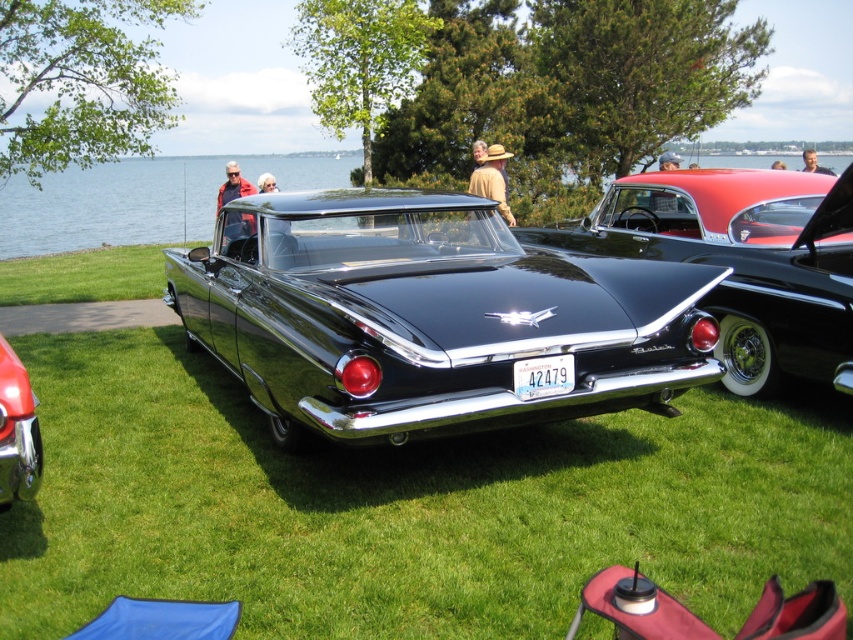
You are a photographer planning to capture both the glossy black car at center and the shiny red car at lower left in a single frame. Given that your camera can only accommodate objects within a 10m width, can you fit both cars side by side without cropping?

The glossy black car at center is wider than the shiny red car at lower left. Since the camera can only accommodate 10 meters, but the combined width of both cars may exceed this limit, it depends on their exact dimensions. However, the description only states the glossy black car is wider, not the total width. Without specific measurements, it is uncertain if they can fit together.

You are a photographer at the car exhibition and need to capture a photo that includes both the black glossy car at center and the white plastic license plate at center. Based on their positions, will the license plate be visible in the photo if you focus on the car?

The black glossy car at center is above the white plastic license plate at center, so if you focus on the car, the license plate will still be visible in the photo as it is positioned below the car.

You are a photographer trying to capture the glossy black car at center and the white plastic license plate at center in a single shot. Since you want to ensure both are clearly visible, which object should you focus on first to account for their size difference?

The glossy black car at center is taller than the white plastic license plate at center, so you should focus on the glossy black car at center first to ensure its details are sharp before adjusting for the smaller license plate.